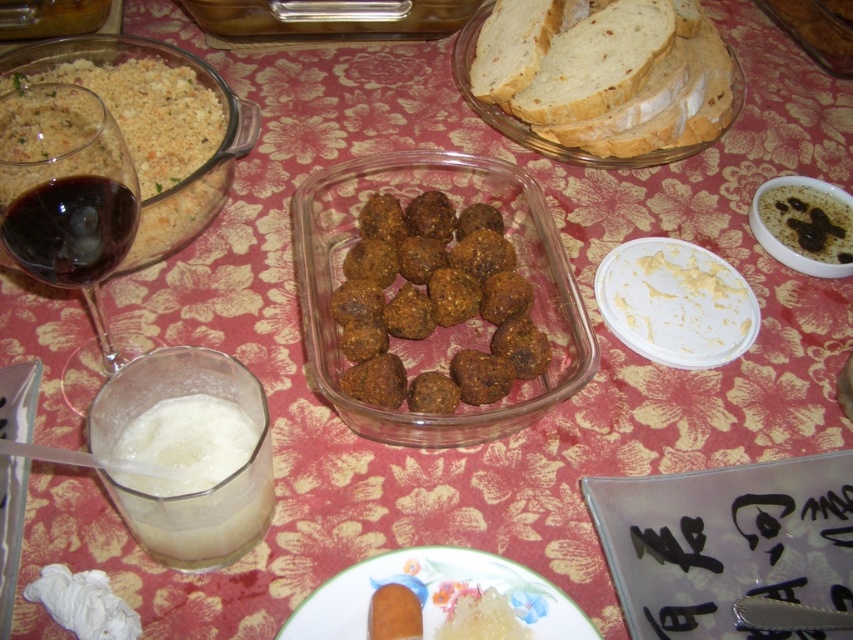
Can you confirm if white soft bread at upper right is shorter than dark red liquid at left?

In fact, white soft bread at upper right may be taller than dark red liquid at left.

This screenshot has height=640, width=853. Identify the location of white soft bread at upper right. (648, 104).

Between point (403, 216) and point (712, 346), which one is positioned behind?

The point (403, 216) is behind.

Does brown crumbly meatballs at center appear over white matte plate at upper right?

No.

Does point (399, 243) lie behind point (708, 362)?

Yes, point (399, 243) is behind point (708, 362).

Image resolution: width=853 pixels, height=640 pixels. Find the location of `brown crumbly meatballs at center`. brown crumbly meatballs at center is located at coordinates (434, 304).

Measure the distance between transparent glass wine at left and camera.

A distance of 29.88 centimeters exists between transparent glass wine at left and camera.

Who is lower down, transparent glass wine at left or white matte plate at upper right?

white matte plate at upper right is lower down.

Where is `transparent glass wine at left`? The width and height of the screenshot is (853, 640). transparent glass wine at left is located at coordinates (67, 193).